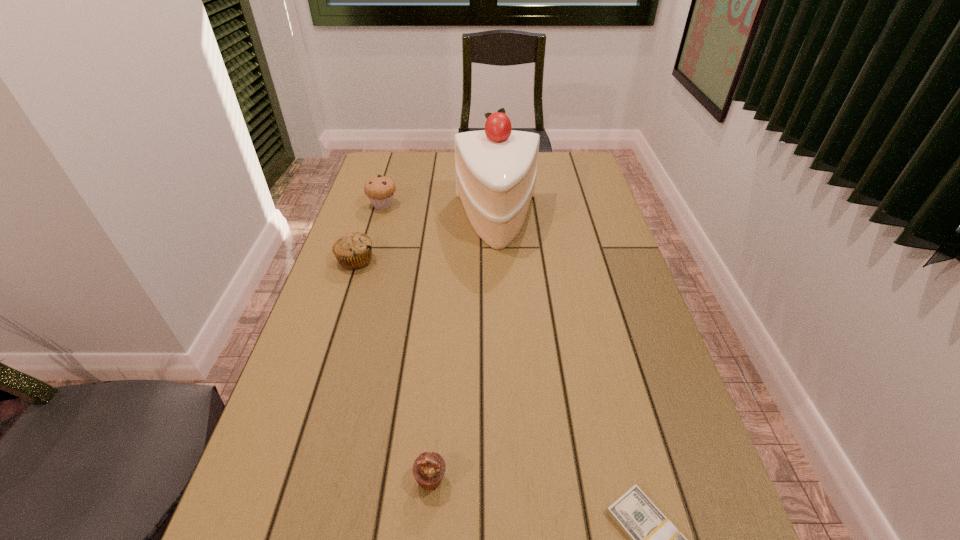
Identify the location of cake. (496, 168).

The image size is (960, 540). I want to click on the farthest muffin, so click(380, 190).

This screenshot has height=540, width=960. Identify the location of the second nearest muffin. (353, 250).

Locate an element on the screen. the rightmost muffin is located at coordinates (429, 468).

Where is `vacant space located on the front of the tallest object`? The width and height of the screenshot is (960, 540). vacant space located on the front of the tallest object is located at coordinates (503, 343).

The image size is (960, 540). Find the location of `vacant space located on the back of the farthest muffin`. vacant space located on the back of the farthest muffin is located at coordinates (389, 186).

At what (x,y) coordinates should I click in order to perform the action: click on free space located on the back of the second nearest muffin. Please return your answer as a coordinate pair (x, y). Looking at the image, I should click on (380, 186).

Where is `vacant point located 0.230m on the right of the rightmost muffin`? vacant point located 0.230m on the right of the rightmost muffin is located at coordinates (574, 480).

Where is `vacant space at the far edge`? The height and width of the screenshot is (540, 960). vacant space at the far edge is located at coordinates [455, 173].

Identify the location of vacant area at the left edge. The height and width of the screenshot is (540, 960). (325, 400).